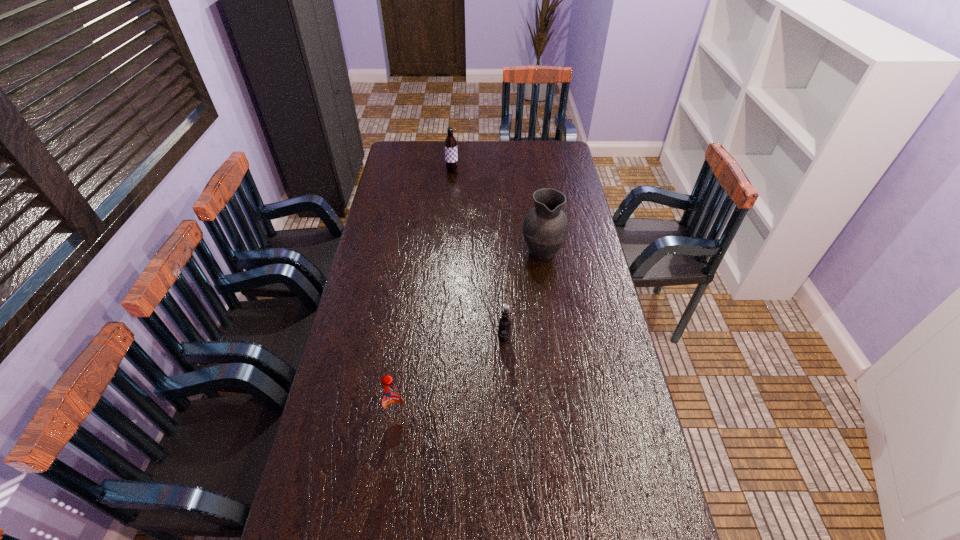
The height and width of the screenshot is (540, 960). Identify the location of free region located on the side of the tallest object with the handle. (532, 180).

The image size is (960, 540). I want to click on free location located on the right of the third object from right to left, so click(x=475, y=171).

This screenshot has width=960, height=540. In order to click on free location located on the left of the nearest root beer in this screenshot , I will do `click(331, 419)`.

Locate an element on the screen. This screenshot has width=960, height=540. vacant area located on the label of the shortest root beer is located at coordinates (506, 370).

Locate an element on the screen. object located at the right edge is located at coordinates (545, 228).

You are a GUI agent. You are given a task and a screenshot of the screen. Output one action in this format:
    pyautogui.click(x=<x>, y=<y>)
    Task: Click on the vacant region at the far edge of the desktop
    This screenshot has height=540, width=960.
    Given the screenshot: What is the action you would take?
    pyautogui.click(x=492, y=160)

Locate an element on the screen. The width and height of the screenshot is (960, 540). vacant point at the left edge is located at coordinates (381, 244).

Identify the location of free point at the right edge. This screenshot has height=540, width=960. (584, 387).

The height and width of the screenshot is (540, 960). In order to click on unoccupied position between the rightmost object and the second root beer from right to left in this screenshot , I will do `click(497, 211)`.

At what (x,y) coordinates should I click in order to perform the action: click on blank region between the farthest root beer and the second farthest object. Please return your answer as a coordinate pair (x, y). Image resolution: width=960 pixels, height=540 pixels. Looking at the image, I should click on (497, 211).